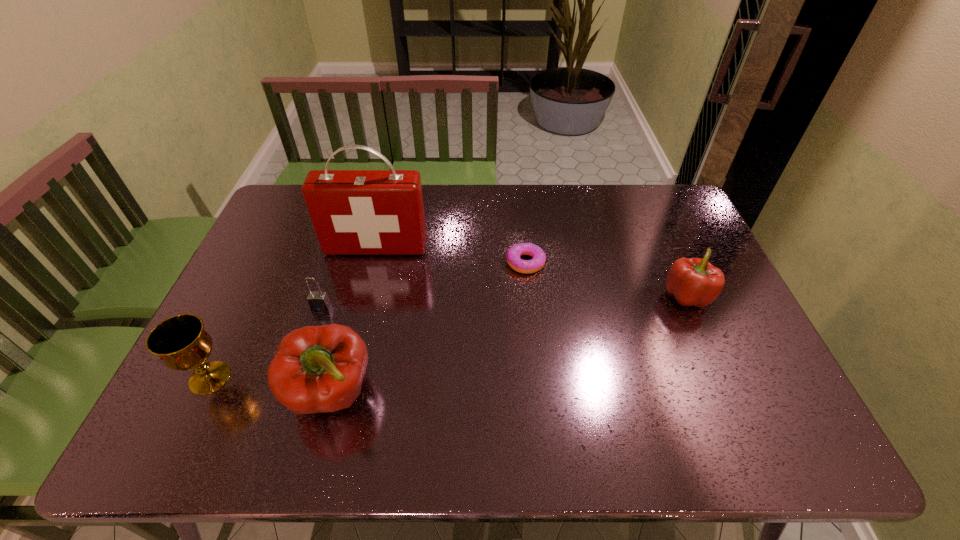
In the image, there is a desktop. Identify the location of vacant region at the far edge. (441, 211).

Where is `free space at the left edge of the desktop`? Image resolution: width=960 pixels, height=540 pixels. free space at the left edge of the desktop is located at coordinates (229, 344).

This screenshot has height=540, width=960. In order to click on vacant space at the right edge of the desktop in this screenshot , I will do `click(676, 242)`.

Locate an element on the screen. This screenshot has width=960, height=540. blank space at the near left corner is located at coordinates (228, 406).

I want to click on blank area at the far right corner, so click(x=641, y=191).

Locate an element on the screen. This screenshot has width=960, height=540. free space at the near right corner of the desktop is located at coordinates pyautogui.click(x=752, y=395).

Find the location of `vacant point located between the nearer bell pepper and the shorter bell pepper`. vacant point located between the nearer bell pepper and the shorter bell pepper is located at coordinates (510, 345).

Identify the location of vacant region between the nearer bell pepper and the farther bell pepper. (510, 345).

Find the location of a particular element. free point between the nearer bell pepper and the tallest object is located at coordinates (354, 320).

The height and width of the screenshot is (540, 960). What are the coordinates of `free space between the shorter bell pepper and the second object from right to left` in the screenshot? It's located at (606, 279).